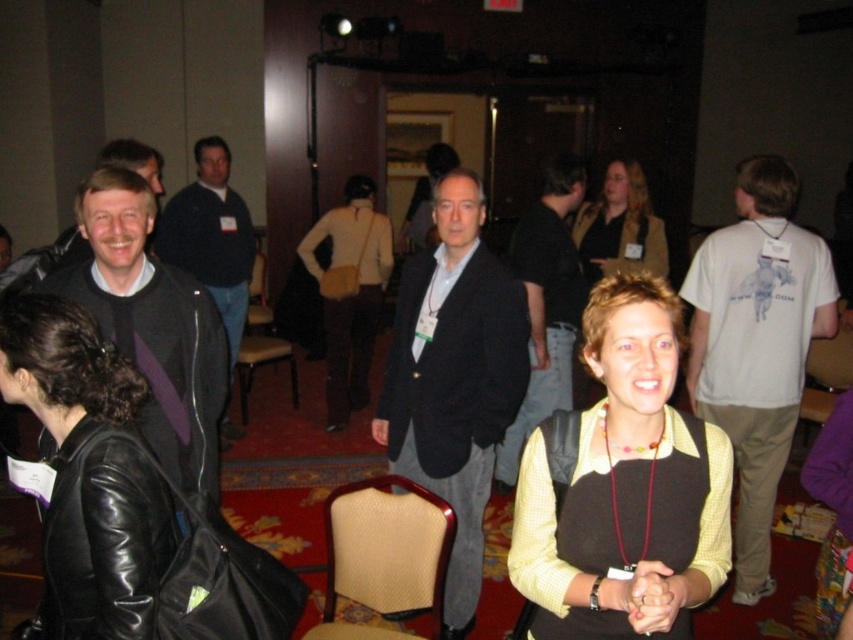
You are organizing a photo shoot and need to arrange the dark gray suit at center and the black leather jacket at left based on their sizes. Which one should be placed first if you want to arrange them from largest to smallest?

The dark gray suit at center should be placed first because it has a larger size compared to the black leather jacket at left.